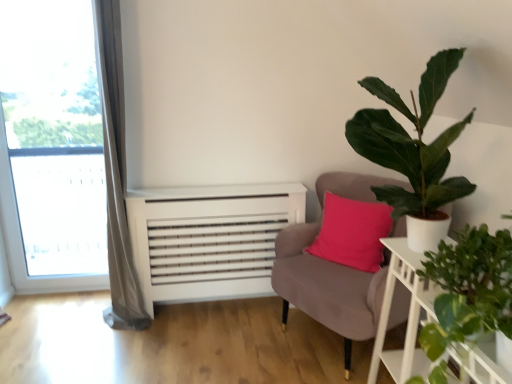
Locate an element on the screen. The image size is (512, 384). vacant space positioned to the left of velvet pink chair at center is located at coordinates (224, 340).